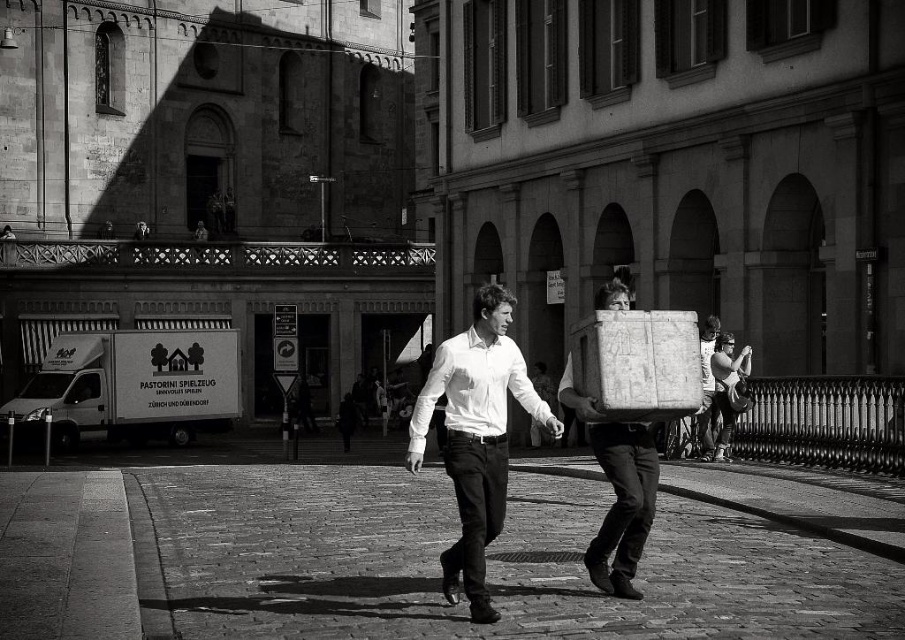
Question: In this image, where is brick pavement at center located relative to white smooth shirt at center?

Choices:
 (A) below
 (B) above

Answer: (A)

Question: Is white smooth shirt at center positioned before matte white suitcase at center?

Choices:
 (A) yes
 (B) no

Answer: (A)

Question: Can you confirm if white smooth shirt at center is wider than smooth cardboard box at center?

Choices:
 (A) yes
 (B) no

Answer: (B)

Question: Among these objects, which one is nearest to the camera?

Choices:
 (A) brick pavement at center
 (B) white smooth shirt at center
 (C) smooth cardboard box at center
 (D) textured cardboard box at center

Answer: (A)

Question: Which point is closer to the camera?

Choices:
 (A) (310, 509)
 (B) (644, 476)
 (C) (464, 506)
 (D) (715, 412)

Answer: (C)

Question: Estimate the real-world distances between objects in this image. Which object is closer to the textured cardboard box at center?

Choices:
 (A) brick pavement at center
 (B) smooth cardboard box at center

Answer: (B)